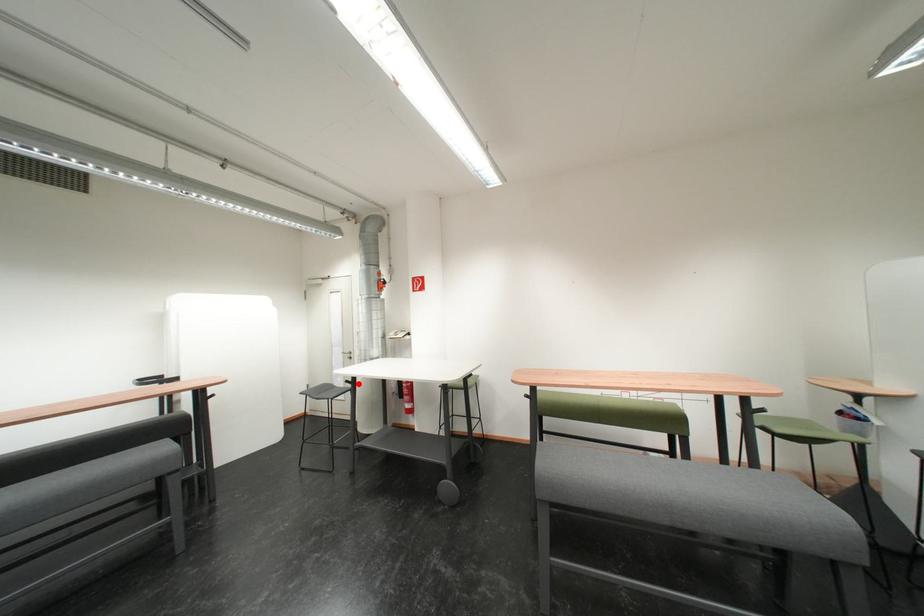
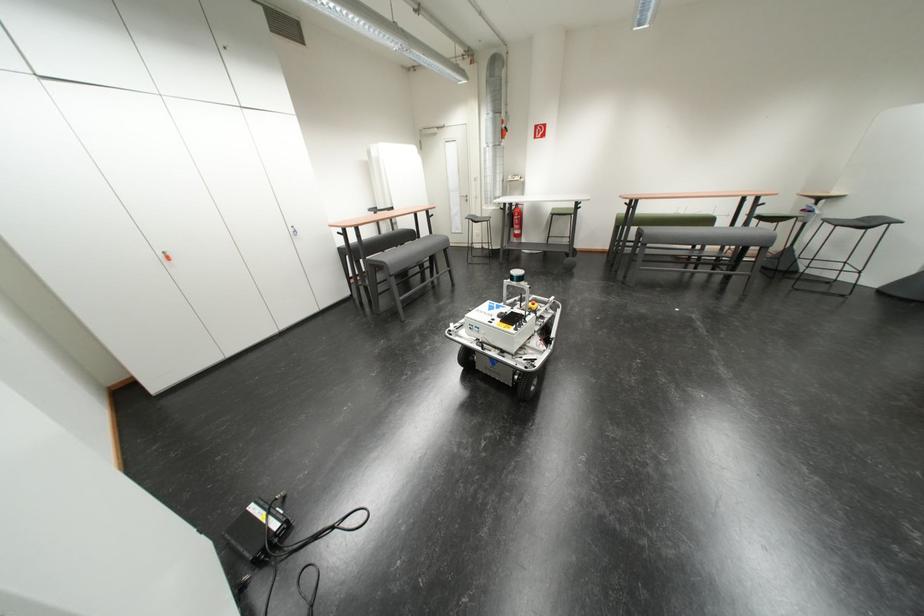
Question: A red point is marked in image1. In image2, is the corresponding 3D point closer to the camera or farther? Reply with the corresponding letter.

Choices:
 (A) The corresponding 3D point is closer.
 (B) The corresponding 3D point is farther.

Answer: (A)